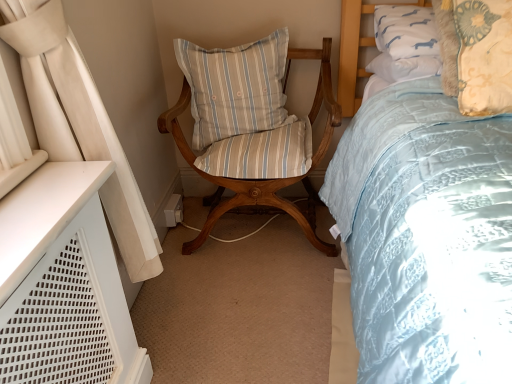
Where is `free location in front of wooden chair with striped cushion at center`? The image size is (512, 384). free location in front of wooden chair with striped cushion at center is located at coordinates (248, 311).